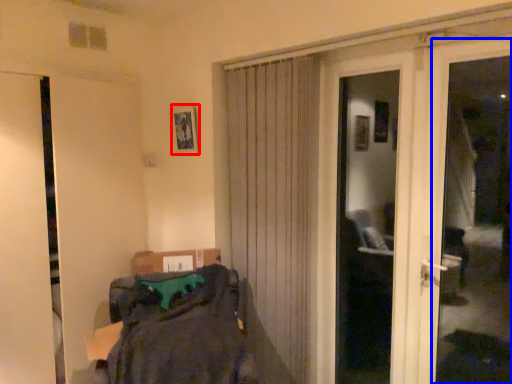
Question: Which object appears closest to the camera in this image, picture frame (highlighted by a red box) or window frame (highlighted by a blue box)?

Choices:
 (A) picture frame
 (B) window frame

Answer: (B)